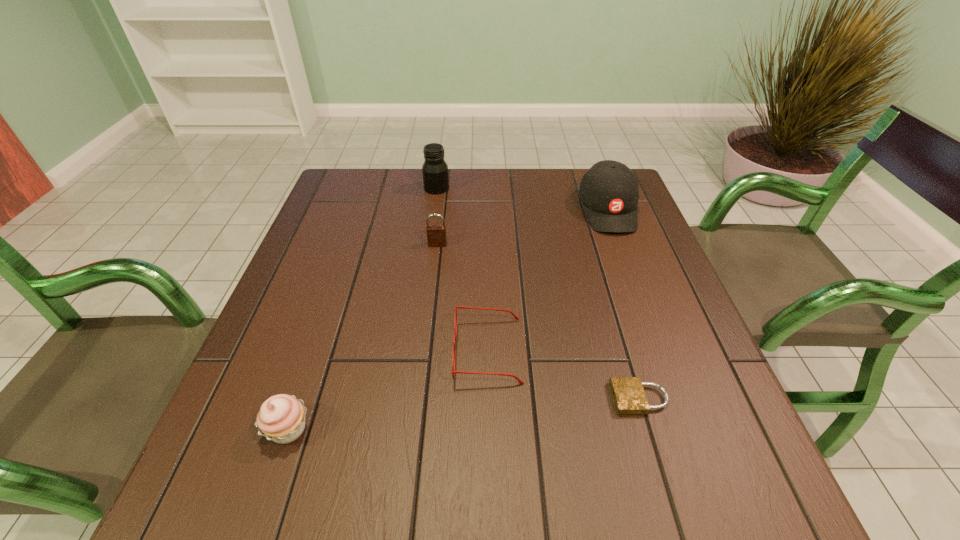
This screenshot has height=540, width=960. What are the coordinates of `free space located 0.140m with a logo on the front of the baseball cap` in the screenshot? It's located at (631, 272).

The width and height of the screenshot is (960, 540). Find the location of `vacant region located 0.090m on the front-facing side of the taller padlock`. vacant region located 0.090m on the front-facing side of the taller padlock is located at coordinates (435, 271).

Identify the location of vacant space situated on the right of the cupcake. (342, 430).

This screenshot has width=960, height=540. What are the coordinates of `vacant region located on the face of the third object from right to left` in the screenshot? It's located at coord(365,351).

I want to click on free space located on the face of the third object from right to left, so click(310, 351).

I want to click on free space located 0.310m on the face of the third object from right to left, so click(300, 351).

At what (x,y) coordinates should I click in order to perform the action: click on vacant space situated 0.200m on the keyhole side of the shortest object. Please return your answer as a coordinate pair (x, y). The image size is (960, 540). Looking at the image, I should click on (503, 398).

You are a GUI agent. You are given a task and a screenshot of the screen. Output one action in this format:
    pyautogui.click(x=<x>, y=<y>)
    Task: Click on the free space located on the keyhole side of the shortest object
    The height and width of the screenshot is (540, 960).
    Given the screenshot: What is the action you would take?
    pyautogui.click(x=476, y=398)

Find the location of a particular element. vacant space positioned 0.330m on the keyhole side of the shortest object is located at coordinates (432, 398).

Where is `jar present at the far edge`? jar present at the far edge is located at coordinates (435, 170).